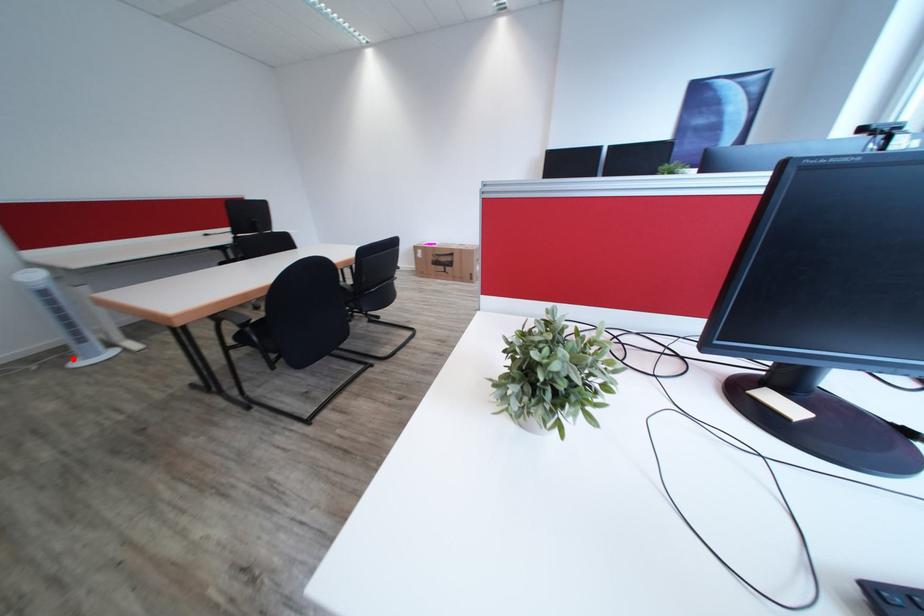
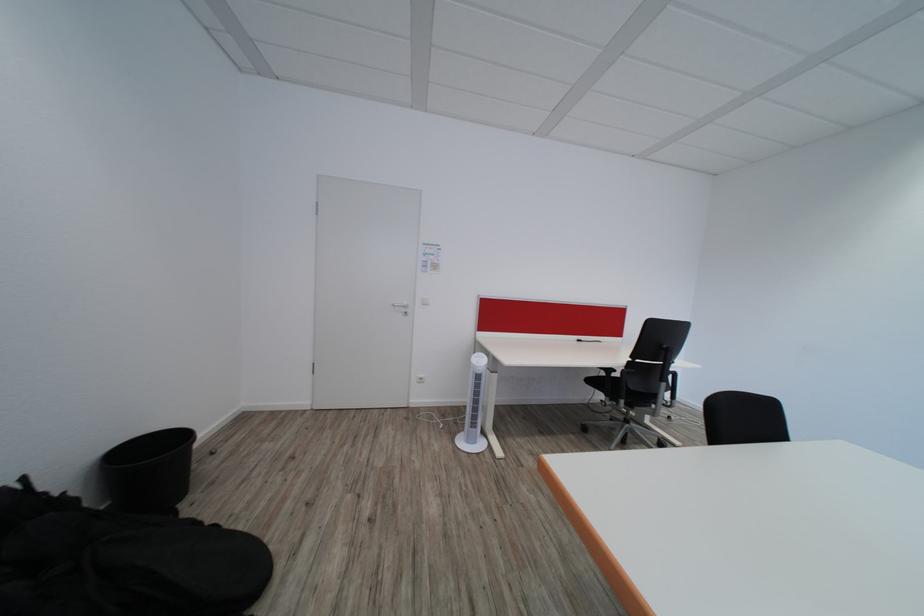
Where in the second image is the point corresponding to the highlighted location from the first image?

(466, 424)